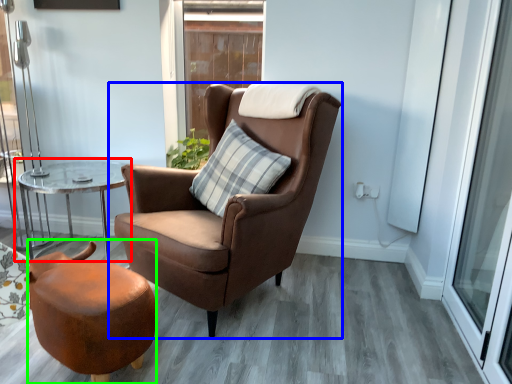
Question: Considering the real-world distances, which object is closest to table (highlighted by a red box)? chair (highlighted by a blue box) or stool (highlighted by a green box).

Choices:
 (A) chair
 (B) stool

Answer: (A)